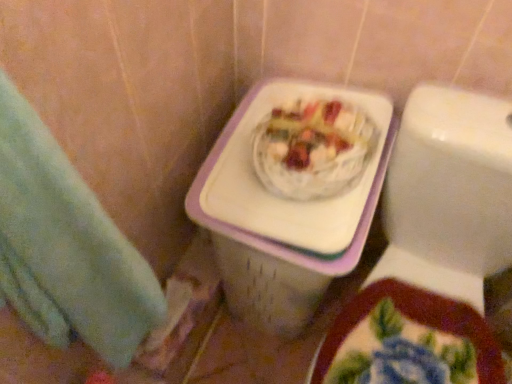
Question: From a real-world perspective, is white glossy toilet at upper right positioned over white plastic basket at center based on gravity?

Choices:
 (A) yes
 (B) no

Answer: (A)

Question: Considering the relative positions of white glossy toilet at upper right and white plastic basket at center in the image provided, is white glossy toilet at upper right to the left of white plastic basket at center from the viewer's perspective?

Choices:
 (A) yes
 (B) no

Answer: (B)

Question: From the image's perspective, is white glossy toilet at upper right located beneath white plastic basket at center?

Choices:
 (A) yes
 (B) no

Answer: (A)

Question: Can you confirm if white glossy toilet at upper right is positioned to the right of white plastic basket at center?

Choices:
 (A) no
 (B) yes

Answer: (B)

Question: Is white glossy toilet at upper right not within white plastic basket at center?

Choices:
 (A) yes
 (B) no

Answer: (A)

Question: Considering the positions of white plastic basket at center and white glossy toilet at upper right in the image, is white plastic basket at center wider or thinner than white glossy toilet at upper right?

Choices:
 (A) wide
 (B) thin

Answer: (B)

Question: Based on their sizes in the image, would you say white plastic basket at center is bigger or smaller than white glossy toilet at upper right?

Choices:
 (A) small
 (B) big

Answer: (A)

Question: Considering their positions, is white plastic basket at center located in front of or behind white glossy toilet at upper right?

Choices:
 (A) front
 (B) behind

Answer: (B)

Question: From a real-world perspective, relative to white glossy toilet at upper right, is white plastic basket at center vertically above or below?

Choices:
 (A) below
 (B) above

Answer: (A)

Question: From a real-world perspective, relative to green towel at left, is white glossy toilet at upper right vertically above or below?

Choices:
 (A) below
 (B) above

Answer: (A)

Question: Considering the positions of white glossy toilet at upper right and green towel at left in the image, is white glossy toilet at upper right taller or shorter than green towel at left?

Choices:
 (A) tall
 (B) short

Answer: (A)

Question: Looking at the image, does white glossy toilet at upper right seem bigger or smaller compared to green towel at left?

Choices:
 (A) big
 (B) small

Answer: (A)

Question: Choose the correct answer: Is white glossy toilet at upper right inside green towel at left or outside it?

Choices:
 (A) outside
 (B) inside

Answer: (A)

Question: Looking at their shapes, would you say white glossy toilet at upper right is wider or thinner than white plastic basket at center?

Choices:
 (A) thin
 (B) wide

Answer: (B)

Question: From a real-world perspective, is white glossy toilet at upper right positioned above or below white plastic basket at center?

Choices:
 (A) below
 (B) above

Answer: (B)